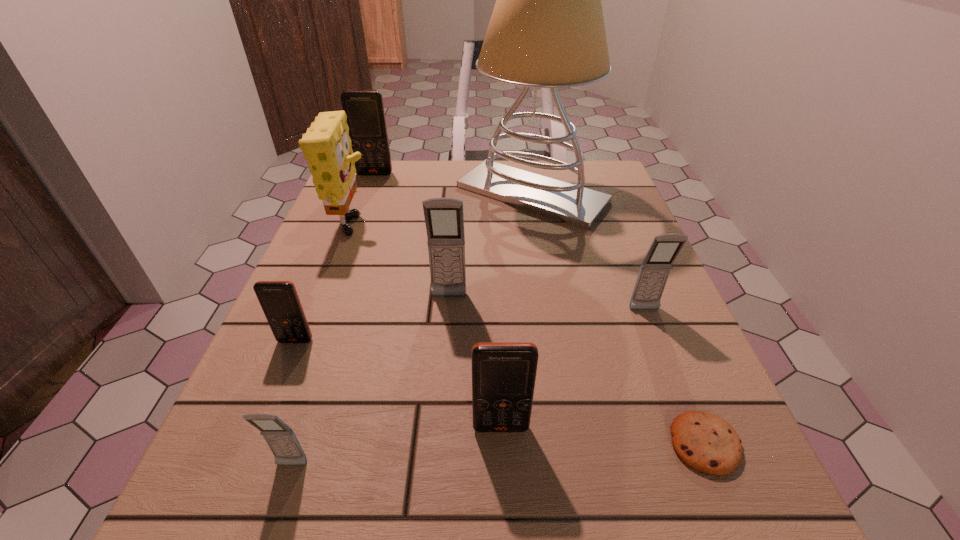
Identify which cellular telephone is located as the nearest to the second cellular telephone from right to left. Please provide its 2D coordinates. Your answer should be formatted as a tuple, i.e. [(x, y)], where the tuple contains the x and y coordinates of a point satisfying the conditions above.

[(281, 439)]

The image size is (960, 540). I want to click on gray cellular telephone that stands as the closest to the shortest object, so click(x=655, y=269).

Point out which gray cellular telephone is positioned as the nearest to the second biggest orange cellular telephone. Please provide its 2D coordinates. Your answer should be formatted as a tuple, i.e. [(x, y)], where the tuple contains the x and y coordinates of a point satisfying the conditions above.

[(281, 439)]

Point out which orange cellular telephone is positioned as the third nearest to the farthest gray cellular telephone. Please provide its 2D coordinates. Your answer should be formatted as a tuple, i.e. [(x, y)], where the tuple contains the x and y coordinates of a point satisfying the conditions above.

[(365, 113)]

Select which orange cellular telephone is the third closest to the biggest gray cellular telephone. Please provide its 2D coordinates. Your answer should be formatted as a tuple, i.e. [(x, y)], where the tuple contains the x and y coordinates of a point satisfying the conditions above.

[(365, 113)]

Identify the location of free spot that satisfies the following two spatial constraints: 1. on the face of the sponge; 2. on the right side of the shortest object. (271, 444).

At what (x,y) coordinates should I click in order to perform the action: click on free space that satisfies the following two spatial constraints: 1. on the screen of the farthest cellular telephone; 2. on the face of the yellow sponge. Please return your answer as a coordinate pair (x, y). This screenshot has height=540, width=960. Looking at the image, I should click on (353, 231).